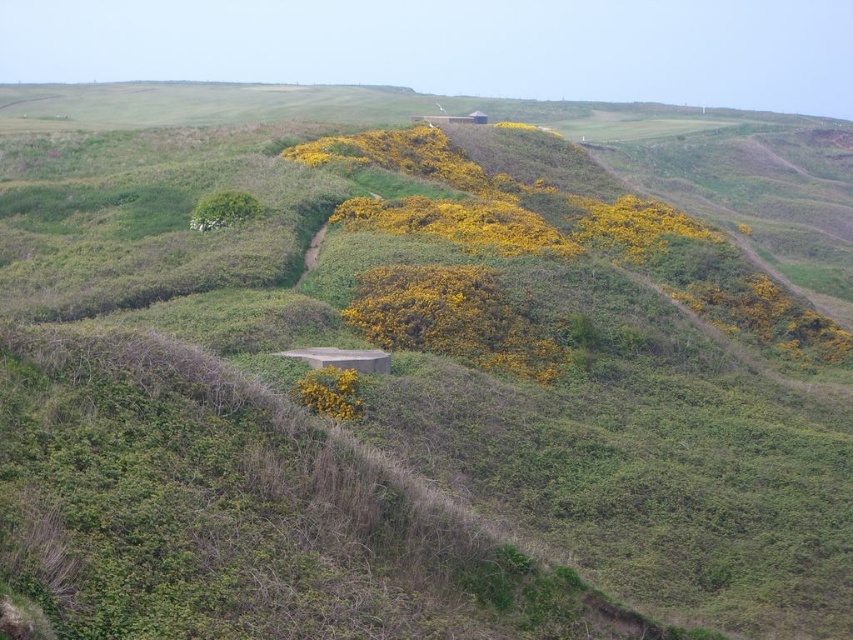
Which of these two, yellow-green foliage at center or yellow matte flowers at center, stands taller?

With more height is yellow-green foliage at center.

Is point (679, 280) farther from viewer compared to point (527, 234)?

Yes, it is behind point (527, 234).

Is point (720, 275) in front of point (549, 227)?

That is False.

This screenshot has width=853, height=640. I want to click on yellow-green foliage at center, so click(x=579, y=234).

Is point (366, 204) farther from viewer compared to point (329, 380)?

That is True.

Can you confirm if yellow matte flowers at center is wider than yellow matte flower at center?

Indeed, yellow matte flowers at center has a greater width compared to yellow matte flower at center.

Who is more forward, (578, 250) or (349, 384)?

Point (349, 384)

The height and width of the screenshot is (640, 853). Find the location of `yellow matte flowers at center`. yellow matte flowers at center is located at coordinates (456, 224).

Can you confirm if yellow-green foliage at center is positioned to the left of yellow matte flower at center?

No, yellow-green foliage at center is not to the left of yellow matte flower at center.

Is yellow-green foliage at center smaller than yellow matte flower at center?

No, yellow-green foliage at center is not smaller than yellow matte flower at center.

What do you see at coordinates (579, 234) in the screenshot?
I see `yellow-green foliage at center` at bounding box center [579, 234].

Image resolution: width=853 pixels, height=640 pixels. Identify the location of yellow-green foliage at center. (579, 234).